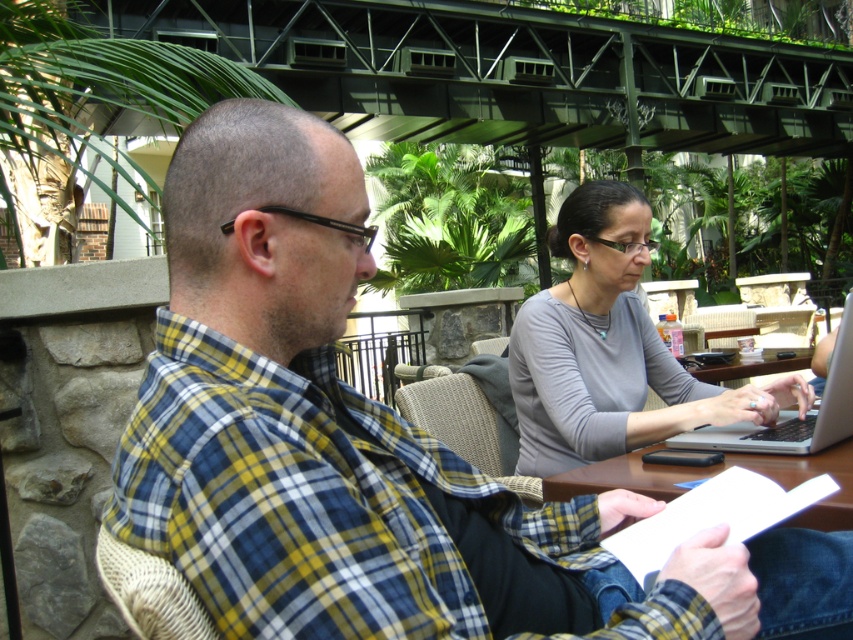
Is plaid shirt at center positioned at the back of white glossy table at center?

No, plaid shirt at center is in front of white glossy table at center.

Measure the distance between plaid shirt at center and camera.

27.00 inches

Identify the location of plaid shirt at center. (340, 435).

Does point (505, 596) come closer to viewer compared to point (590, 196)?

Yes.

From the picture: Who is more forward, [316,500] or [563,216]?

Positioned in front is point [316,500].

At what (x,y) coordinates should I click in order to perform the action: click on plaid shirt at center. Please return your answer as a coordinate pair (x, y). The image size is (853, 640). Looking at the image, I should click on (340, 435).

Between gray matte shirt at center and white glossy table at center, which one has more height?

gray matte shirt at center is taller.

Does point (590, 321) lie behind point (772, 470)?

Yes, point (590, 321) is farther from viewer.

Who is more distant from viewer, (621, 346) or (724, 449)?

The point (621, 346) is more distant.

The height and width of the screenshot is (640, 853). What are the coordinates of `gray matte shirt at center` in the screenshot? It's located at (610, 348).